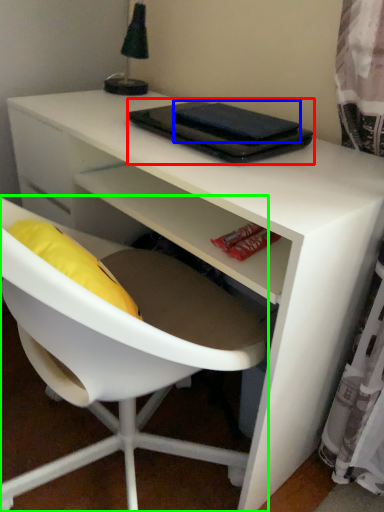
Question: Based on their relative distances, which object is farther from notebook (highlighted by a red box)? Choose from notebook (highlighted by a blue box) and chair (highlighted by a green box).

Choices:
 (A) notebook
 (B) chair

Answer: (B)